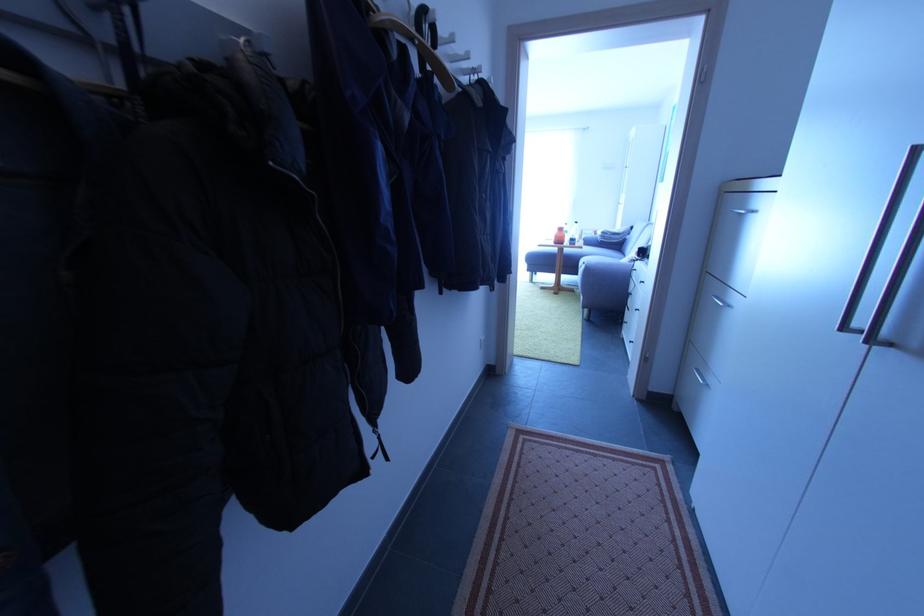
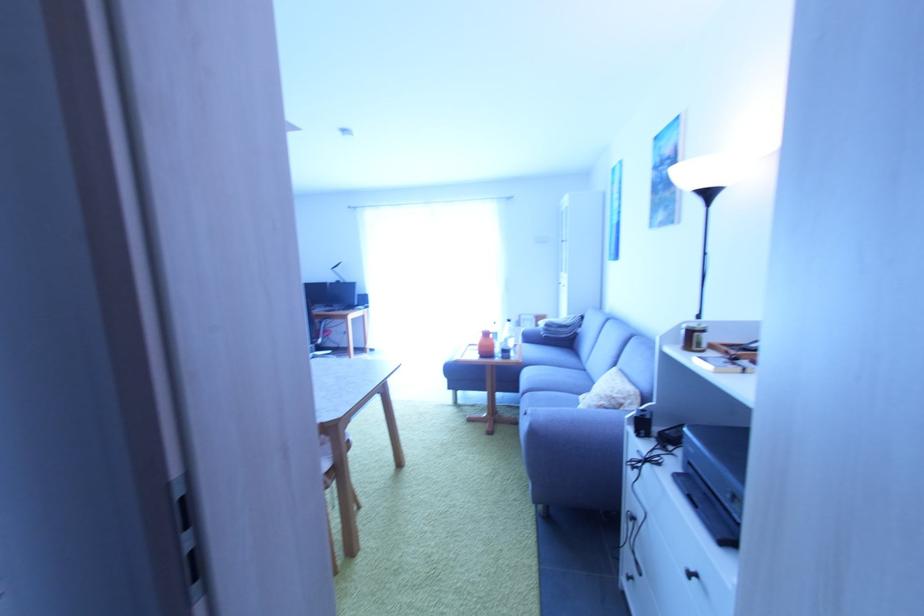
Locate, in the second image, the point that corresponds to [565,232] in the first image.

(492, 336)